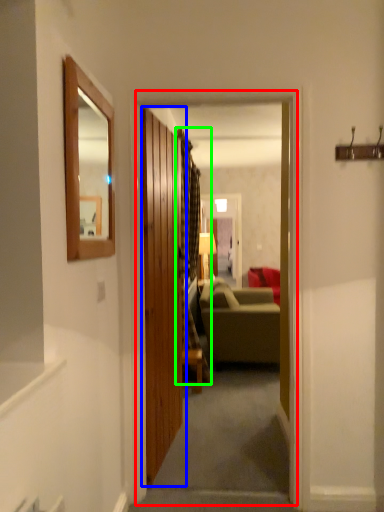
Question: Based on their relative distances, which object is farther from corridor (highlighted by a red box)? Choose from door (highlighted by a blue box) and curtain (highlighted by a green box).

Choices:
 (A) door
 (B) curtain

Answer: (A)